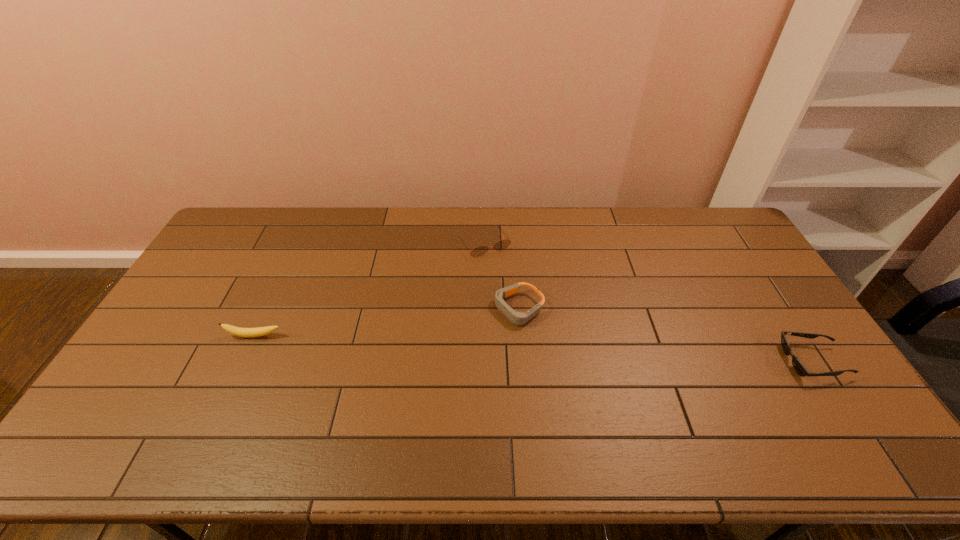
Where is `free space between the left sunglasses and the nearer sunglasses`? free space between the left sunglasses and the nearer sunglasses is located at coordinates (649, 302).

What are the coordinates of `vacant area that lies between the leftmost object and the third nearest object` in the screenshot? It's located at (387, 322).

The image size is (960, 540). Identify the location of vacant space in between the goggles and the right sunglasses. (666, 335).

Locate an element on the screen. Image resolution: width=960 pixels, height=540 pixels. blank region between the right sunglasses and the farthest object is located at coordinates (x=649, y=302).

Locate an element on the screen. object that ranks as the third closest to the left sunglasses is located at coordinates (798, 366).

Where is `object that can be found as the third closest to the left sunglasses`? object that can be found as the third closest to the left sunglasses is located at coordinates (798, 366).

Identify the location of blank area in the image that satisfies the following two spatial constraints: 1. on the front side of the nearest object; 2. on the front-facing side of the goggles. (524, 361).

Where is `vacant area in the image that satisfies the following two spatial constraints: 1. on the front side of the third nearest object; 2. on the front-facing side of the rightmost object`? vacant area in the image that satisfies the following two spatial constraints: 1. on the front side of the third nearest object; 2. on the front-facing side of the rightmost object is located at coordinates (524, 361).

Find the location of a particular element. This screenshot has width=960, height=540. free space in the image that satisfies the following two spatial constraints: 1. on the upward curve of the second nearest object; 2. on the front-facing side of the rightmost object is located at coordinates (243, 361).

The image size is (960, 540). Identify the location of vacant position in the image that satisfies the following two spatial constraints: 1. on the upward curve of the leftmost object; 2. on the front-facing side of the nearer sunglasses. (243, 361).